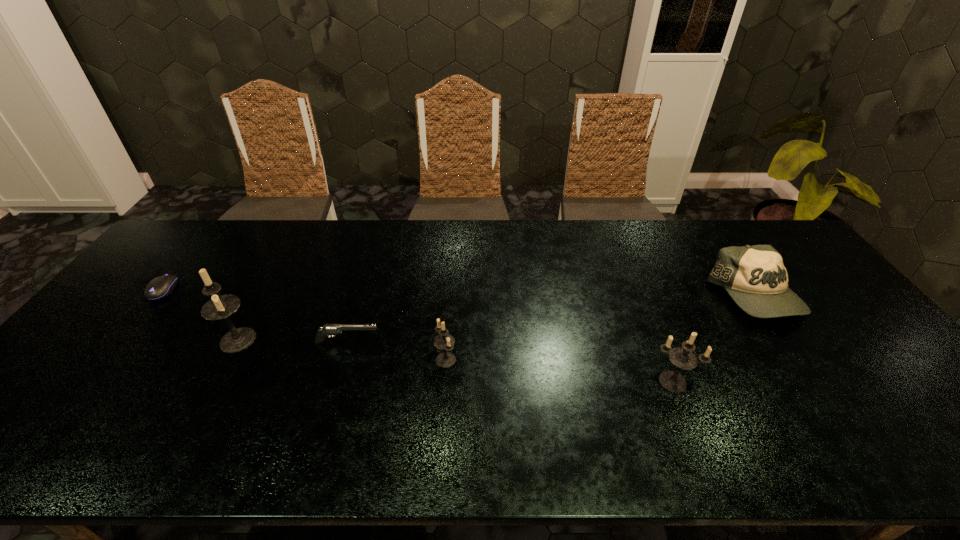
You are a GUI agent. You are given a task and a screenshot of the screen. Output one action in this format:
    pyautogui.click(x=<x>, y=<y>)
    Task: Click on the object located at the right edge
    The height and width of the screenshot is (540, 960).
    Given the screenshot: What is the action you would take?
    pyautogui.click(x=755, y=278)

Locate an element on the screen. This screenshot has height=540, width=960. vacant space at the far edge of the desktop is located at coordinates (311, 225).

In the image, there is a desktop. Find the location of `vacant space at the near edge`. vacant space at the near edge is located at coordinates (809, 393).

Locate an element on the screen. free space at the left edge of the desktop is located at coordinates (78, 372).

This screenshot has height=540, width=960. In the image, there is a desktop. What are the coordinates of `vacant area at the right edge` in the screenshot? It's located at (801, 316).

Image resolution: width=960 pixels, height=540 pixels. Find the location of `vacant space at the far left corner of the desktop`. vacant space at the far left corner of the desktop is located at coordinates (186, 233).

Find the location of a particular element. This screenshot has height=540, width=960. vacant area at the far right corner is located at coordinates [753, 241].

You are a GUI agent. You are given a task and a screenshot of the screen. Output one action in this format:
    pyautogui.click(x=<x>, y=<y>)
    Task: Click on the free space that is in between the pistol and the leftmost object
    
    Given the screenshot: What is the action you would take?
    pyautogui.click(x=255, y=316)

Where is `free spot between the fourth object from right to left and the third shortest object`? This screenshot has width=960, height=540. free spot between the fourth object from right to left and the third shortest object is located at coordinates pyautogui.click(x=551, y=319).

Image resolution: width=960 pixels, height=540 pixels. Identify the location of vacant area that lies between the tallest object and the second candle holder from right to left. (342, 350).